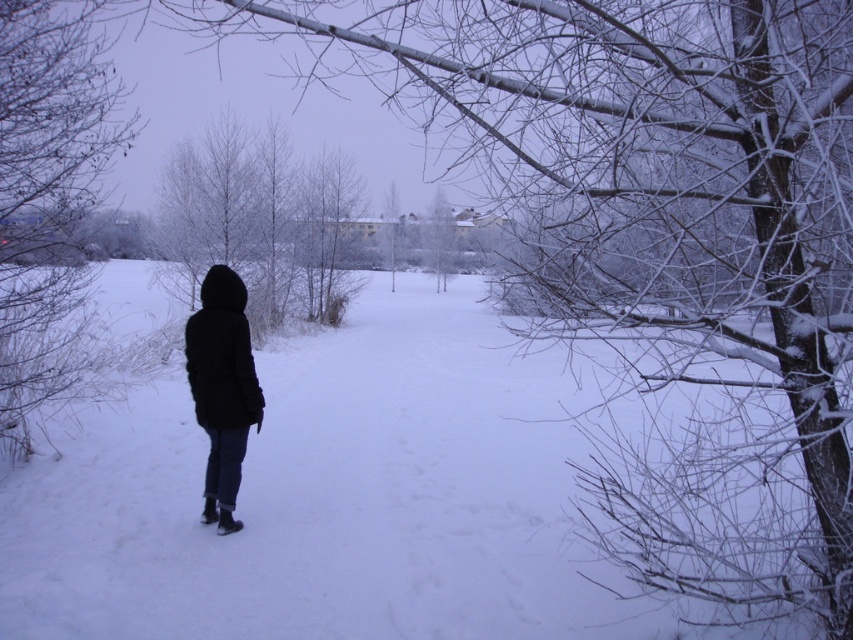
Question: Does white frosty branches at left have a larger size compared to black matte coat at center?

Choices:
 (A) yes
 (B) no

Answer: (B)

Question: Which point is farther to the camera?

Choices:
 (A) white frosty branches at left
 (B) black matte coat at center

Answer: (A)

Question: Is white frosty branches at left below black matte coat at center?

Choices:
 (A) no
 (B) yes

Answer: (A)

Question: Can you confirm if white frosty branches at left is bigger than black matte coat at center?

Choices:
 (A) yes
 (B) no

Answer: (B)